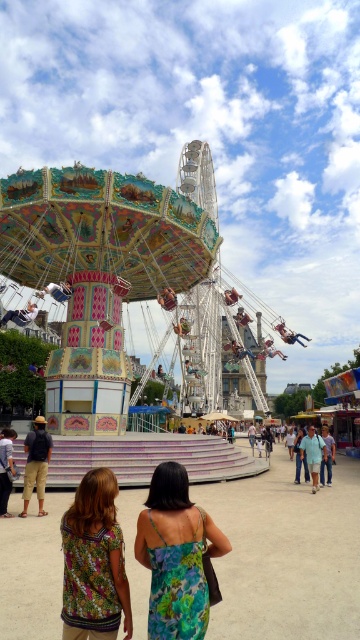
Question: Can you confirm if green floral dress at center is smaller than dark blue shirt at lower left?

Choices:
 (A) yes
 (B) no

Answer: (A)

Question: Which point appears closest to the camera in this image?

Choices:
 (A) (5, 488)
 (B) (111, 484)

Answer: (B)

Question: Does green floral dress at center come in front of dark blue shirt at lower left?

Choices:
 (A) yes
 (B) no

Answer: (A)

Question: Observing the image, what is the correct spatial positioning of floral fabric blouse at lower center in reference to dark blue shirt at lower left?

Choices:
 (A) below
 (B) above

Answer: (B)

Question: Which is nearer to the floral fabric blouse at lower center?

Choices:
 (A) matte black shoe at lower left
 (B) dark blue shirt at lower left
 (C) dark blue denim jeans at lower left

Answer: (B)

Question: Based on their relative distances, which object is farther from the floral fabric blouse at lower center?

Choices:
 (A) dark blue shirt at lower left
 (B) matte black shoe at lower left
 (C) dark blue denim jeans at lower left
 (D) green floral dress at center

Answer: (B)